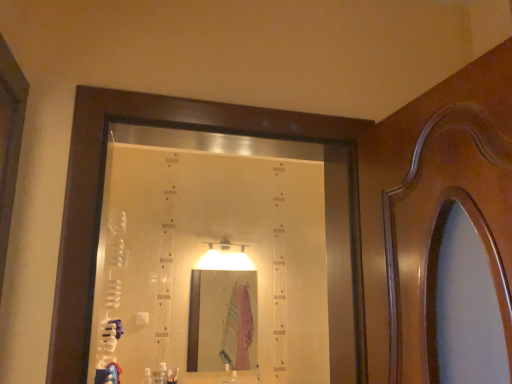
Question: Would you say blue cotton robe at lower left is to the left or to the right of clear plastic bottle at lower center, the 1th toiletry when ordered from right to left, in the picture?

Choices:
 (A) right
 (B) left

Answer: (B)

Question: From a real-world perspective, relative to clear plastic bottle at lower center, the 2th toiletry when ordered from left to right, is blue cotton robe at lower left vertically above or below?

Choices:
 (A) above
 (B) below

Answer: (A)

Question: Considering the real-world distances, which object is closest to the white plastic bottle at lower center, which is the second toiletry from right to left?

Choices:
 (A) clear plastic bottle at lower center, the 2th toiletry when ordered from left to right
 (B) pink fabric at center
 (C) blue cotton robe at lower left

Answer: (A)

Question: Based on their relative distances, which object is farther from the clear plastic bottle at lower center, the 2th toiletry when ordered from left to right?

Choices:
 (A) white plastic bottle at lower center, positioned as the first toiletry in left-to-right order
 (B) pink fabric at center
 (C) blue cotton robe at lower left

Answer: (C)